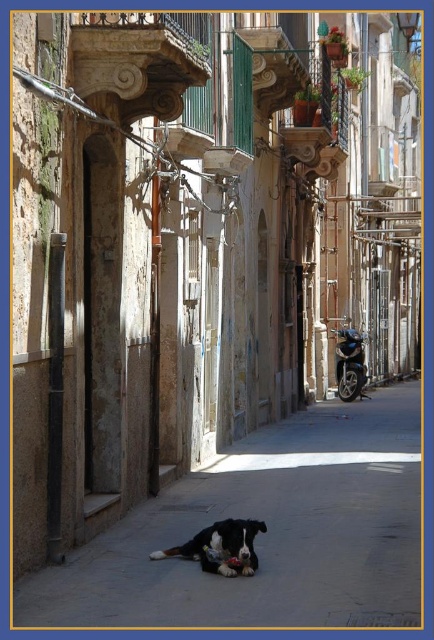
Question: Is smooth concrete pavement at center positioned before shiny blue motorcycle at center-right?

Choices:
 (A) yes
 (B) no

Answer: (A)

Question: Which of the following is the farthest from the observer?

Choices:
 (A) shiny blue motorcycle at center-right
 (B) black fur dog at center

Answer: (A)

Question: Is smooth concrete pavement at center further to the viewer compared to shiny blue motorcycle at center-right?

Choices:
 (A) no
 (B) yes

Answer: (A)

Question: Based on their relative distances, which object is farther from the smooth concrete pavement at center?

Choices:
 (A) black fur dog at center
 (B) shiny blue motorcycle at center-right

Answer: (B)

Question: Is smooth concrete pavement at center below shiny blue motorcycle at center-right?

Choices:
 (A) no
 (B) yes

Answer: (B)

Question: Which is farther from the shiny blue motorcycle at center-right?

Choices:
 (A) black fur dog at center
 (B) smooth concrete pavement at center

Answer: (A)